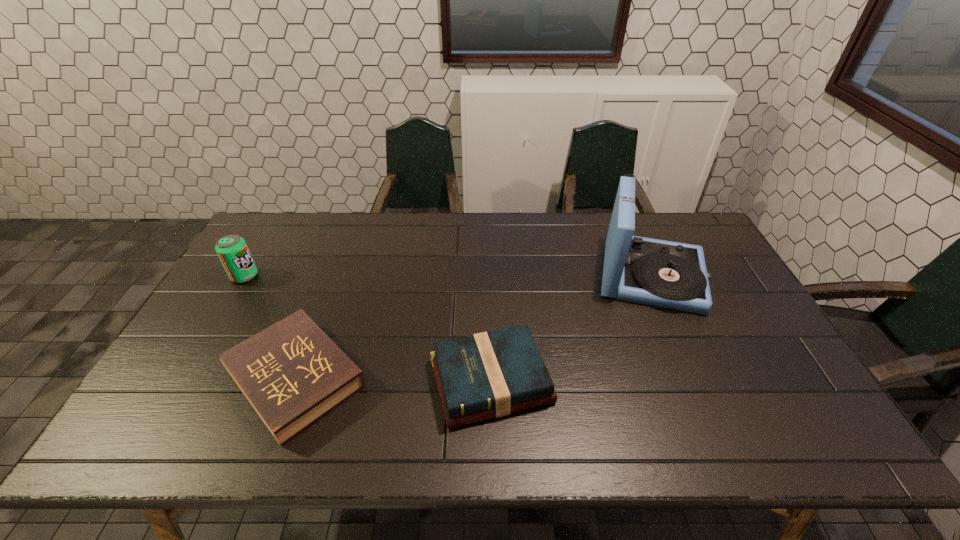
You are a GUI agent. You are given a task and a screenshot of the screen. Output one action in this format:
    pyautogui.click(x=<x>, y=<y>)
    Task: Click on the vacant space located 0.110m on the right of the third object from right to left
    This screenshot has width=960, height=540.
    Given the screenshot: What is the action you would take?
    pyautogui.click(x=412, y=379)

In order to click on object present at the far edge in this screenshot , I will do `click(666, 274)`.

Where is `pop soda that is at the left edge`? The width and height of the screenshot is (960, 540). pop soda that is at the left edge is located at coordinates (232, 250).

Identify the location of hardback book located in the left edge section of the desktop. (292, 373).

Identify the location of object that is at the right edge. (666, 274).

Where is `object that is at the near left corner`? object that is at the near left corner is located at coordinates (292, 373).

I want to click on object at the far right corner, so click(x=666, y=274).

At what (x,y) coordinates should I click in order to perform the action: click on vacant area at the far edge of the desktop. Please return your answer as a coordinate pair (x, y). Image resolution: width=960 pixels, height=540 pixels. Looking at the image, I should click on (644, 215).

In the image, there is a desktop. Find the location of `free space at the near edge`. free space at the near edge is located at coordinates (566, 430).

What are the coordinates of `free space at the left edge` in the screenshot? It's located at (250, 301).